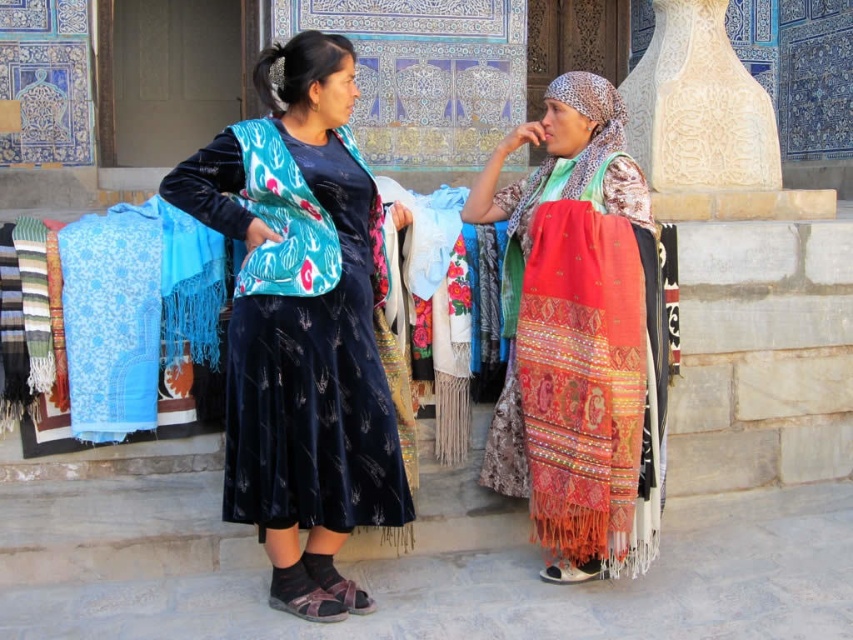
Question: Is velvet blue dress at center closer to the viewer compared to embroidered silk scarf at center?

Choices:
 (A) yes
 (B) no

Answer: (A)

Question: Which of the following is the closest to the observer?

Choices:
 (A) (244, 211)
 (B) (578, 106)

Answer: (A)

Question: Is embroidered silk scarf at center to the right of red woven shawl at right from the viewer's perspective?

Choices:
 (A) no
 (B) yes

Answer: (A)

Question: Based on their relative distances, which object is farther from the embroidered silk scarf at center?

Choices:
 (A) velvet blue dress at center
 (B) red woven shawl at right

Answer: (A)

Question: Which object is the farthest from the embroidered silk scarf at center?

Choices:
 (A) red woven shawl at right
 (B) velvet blue dress at center

Answer: (B)

Question: Observing the image, what is the correct spatial positioning of embroidered silk scarf at center in reference to red woven shawl at right?

Choices:
 (A) left
 (B) right

Answer: (A)